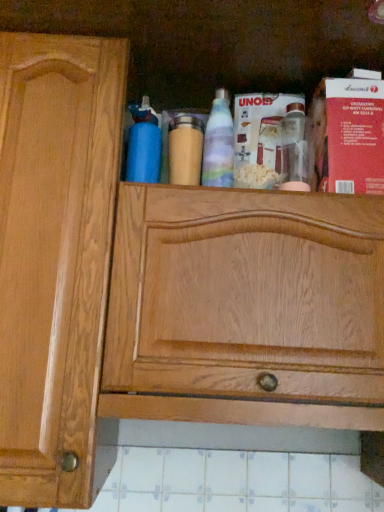
Image resolution: width=384 pixels, height=512 pixels. I want to click on translucent plastic bottle at center, positioned as the third bottle in left-to-right order, so click(219, 144).

Identify the location of wooden bottle at center, acting as the second bottle starting from the right. Image resolution: width=384 pixels, height=512 pixels. (185, 149).

Does point (223, 172) come behind point (180, 156)?

No, it is in front of (180, 156).

Can you confirm if translucent plastic bottle at center, positioned as the third bottle in left-to-right order, is positioned to the left of wooden bottle at center, which ranks as the second bottle in left-to-right order?

No, translucent plastic bottle at center, positioned as the third bottle in left-to-right order, is not to the left of wooden bottle at center, which ranks as the second bottle in left-to-right order.

Which object is more forward, translucent plastic bottle at center, the first bottle viewed from the right, or wooden bottle at center, acting as the second bottle starting from the right?

translucent plastic bottle at center, the first bottle viewed from the right, is in front.

How different are the orientations of translucent plastic bottle at center, positioned as the third bottle in left-to-right order, and wooden bottle at center, acting as the second bottle starting from the right, in degrees?

There is a 8.01e-05-degree angle between the facing directions of translucent plastic bottle at center, positioned as the third bottle in left-to-right order, and wooden bottle at center, acting as the second bottle starting from the right.

Is blue matte bottle at upper center, the third bottle viewed from the right, thinner than wooden bottle at center, acting as the second bottle starting from the right?

In fact, blue matte bottle at upper center, the third bottle viewed from the right, might be wider than wooden bottle at center, acting as the second bottle starting from the right.

From a real-world perspective, is blue matte bottle at upper center, the 1th bottle in the left-to-right sequence, located higher than wooden bottle at center, which ranks as the second bottle in left-to-right order?

Correct, in the physical world, blue matte bottle at upper center, the 1th bottle in the left-to-right sequence, is higher than wooden bottle at center, which ranks as the second bottle in left-to-right order.

Based on the photo, which object is more forward, blue matte bottle at upper center, the third bottle viewed from the right, or wooden bottle at center, acting as the second bottle starting from the right?

Positioned in front is blue matte bottle at upper center, the third bottle viewed from the right.

Consider the image. Considering the relative positions of blue matte bottle at upper center, the third bottle viewed from the right, and wooden bottle at center, which ranks as the second bottle in left-to-right order, in the image provided, is blue matte bottle at upper center, the third bottle viewed from the right, to the right of wooden bottle at center, which ranks as the second bottle in left-to-right order, from the viewer's perspective?

No.

From a real-world perspective, is wooden bottle at center, acting as the second bottle starting from the right, over blue matte bottle at upper center, the third bottle viewed from the right?

No, from a real-world perspective, wooden bottle at center, acting as the second bottle starting from the right, is not above blue matte bottle at upper center, the third bottle viewed from the right.

Are wooden bottle at center, which ranks as the second bottle in left-to-right order, and blue matte bottle at upper center, the 1th bottle in the left-to-right sequence, far apart?

That's not correct — wooden bottle at center, which ranks as the second bottle in left-to-right order, is a little close to blue matte bottle at upper center, the 1th bottle in the left-to-right sequence.

Where is `bottle that is the 1st one when counting upward from the wooden bottle at center, acting as the second bottle starting from the right (from the image's perspective)`? The height and width of the screenshot is (512, 384). bottle that is the 1st one when counting upward from the wooden bottle at center, acting as the second bottle starting from the right (from the image's perspective) is located at coordinates (143, 144).

Between wooden bottle at center, acting as the second bottle starting from the right, and blue matte bottle at upper center, the third bottle viewed from the right, which one has less height?

wooden bottle at center, acting as the second bottle starting from the right, is shorter.

Based on the photo, considering the relative sizes of blue matte bottle at upper center, the 1th bottle in the left-to-right sequence, and translucent plastic bottle at center, positioned as the third bottle in left-to-right order, in the image provided, is blue matte bottle at upper center, the 1th bottle in the left-to-right sequence, wider than translucent plastic bottle at center, positioned as the third bottle in left-to-right order,?

Yes, blue matte bottle at upper center, the 1th bottle in the left-to-right sequence, is wider than translucent plastic bottle at center, positioned as the third bottle in left-to-right order.

Is blue matte bottle at upper center, the third bottle viewed from the right, taller than translucent plastic bottle at center, the first bottle viewed from the right?

No, blue matte bottle at upper center, the third bottle viewed from the right, is not taller than translucent plastic bottle at center, the first bottle viewed from the right.

From a real-world perspective, between blue matte bottle at upper center, the third bottle viewed from the right, and translucent plastic bottle at center, positioned as the third bottle in left-to-right order, who is vertically lower?

From a 3D spatial view, blue matte bottle at upper center, the third bottle viewed from the right, is below.

How many degrees apart are the facing directions of wooden bottle at center, acting as the second bottle starting from the right, and translucent plastic bottle at center, positioned as the third bottle in left-to-right order?

The facing directions of wooden bottle at center, acting as the second bottle starting from the right, and translucent plastic bottle at center, positioned as the third bottle in left-to-right order, are 8.01e-05 degrees apart.

From the picture: Considering the positions of objects wooden bottle at center, acting as the second bottle starting from the right, and translucent plastic bottle at center, the first bottle viewed from the right, in the image provided, who is behind, wooden bottle at center, acting as the second bottle starting from the right, or translucent plastic bottle at center, the first bottle viewed from the right,?

wooden bottle at center, acting as the second bottle starting from the right, is further from the camera.

Can you confirm if wooden bottle at center, acting as the second bottle starting from the right, is bigger than translucent plastic bottle at center, positioned as the third bottle in left-to-right order?

Incorrect, wooden bottle at center, acting as the second bottle starting from the right, is not larger than translucent plastic bottle at center, positioned as the third bottle in left-to-right order.

From a real-world perspective, between wooden bottle at center, which ranks as the second bottle in left-to-right order, and translucent plastic bottle at center, the first bottle viewed from the right, who is vertically higher?

translucent plastic bottle at center, the first bottle viewed from the right, from a real-world perspective.

How far apart are translucent plastic bottle at center, the first bottle viewed from the right, and blue matte bottle at upper center, the third bottle viewed from the right?

translucent plastic bottle at center, the first bottle viewed from the right, is 5.26 inches away from blue matte bottle at upper center, the third bottle viewed from the right.

Looking at this image, looking at the image, does translucent plastic bottle at center, positioned as the third bottle in left-to-right order, seem bigger or smaller compared to blue matte bottle at upper center, the third bottle viewed from the right?

Considering their sizes, translucent plastic bottle at center, positioned as the third bottle in left-to-right order, takes up less space than blue matte bottle at upper center, the third bottle viewed from the right.

Where is `bottle located in front of the translucent plastic bottle at center, the first bottle viewed from the right`? Image resolution: width=384 pixels, height=512 pixels. bottle located in front of the translucent plastic bottle at center, the first bottle viewed from the right is located at coordinates (143, 144).

Between translucent plastic bottle at center, the first bottle viewed from the right, and blue matte bottle at upper center, the third bottle viewed from the right, which one is positioned in front?

Positioned in front is blue matte bottle at upper center, the third bottle viewed from the right.

Locate an element on the screen. This screenshot has width=384, height=512. bottle that is the 2nd one above the wooden bottle at center, acting as the second bottle starting from the right (from a real-world perspective) is located at coordinates (219, 144).

Which bottle is the 2nd one when counting from the back of the blue matte bottle at upper center, the 1th bottle in the left-to-right sequence? Please provide its 2D coordinates.

[(185, 149)]

Looking at the image, which one is located further to translucent plastic bottle at center, the first bottle viewed from the right, wooden bottle at center, acting as the second bottle starting from the right, or blue matte bottle at upper center, the 1th bottle in the left-to-right sequence?

Among the two, blue matte bottle at upper center, the 1th bottle in the left-to-right sequence, is located further to translucent plastic bottle at center, the first bottle viewed from the right.

Considering their positions, is wooden bottle at center, acting as the second bottle starting from the right, positioned further to blue matte bottle at upper center, the third bottle viewed from the right, than translucent plastic bottle at center, the first bottle viewed from the right?

translucent plastic bottle at center, the first bottle viewed from the right, lies further to blue matte bottle at upper center, the third bottle viewed from the right, than the other object.

Which object lies further to the anchor point wooden bottle at center, which ranks as the second bottle in left-to-right order, blue matte bottle at upper center, the third bottle viewed from the right, or translucent plastic bottle at center, positioned as the third bottle in left-to-right order?

blue matte bottle at upper center, the third bottle viewed from the right, lies further to wooden bottle at center, which ranks as the second bottle in left-to-right order, than the other object.

In the scene shown: Which object lies nearer to the anchor point translucent plastic bottle at center, the first bottle viewed from the right, blue matte bottle at upper center, the 1th bottle in the left-to-right sequence, or wooden bottle at center, which ranks as the second bottle in left-to-right order?

wooden bottle at center, which ranks as the second bottle in left-to-right order, is closer to translucent plastic bottle at center, the first bottle viewed from the right.

Looking at the image, which one is located further to blue matte bottle at upper center, the 1th bottle in the left-to-right sequence, translucent plastic bottle at center, positioned as the third bottle in left-to-right order, or wooden bottle at center, acting as the second bottle starting from the right?

Among the two, translucent plastic bottle at center, positioned as the third bottle in left-to-right order, is located further to blue matte bottle at upper center, the 1th bottle in the left-to-right sequence.

Based on their spatial positions, is translucent plastic bottle at center, the first bottle viewed from the right, or blue matte bottle at upper center, the third bottle viewed from the right, further from wooden bottle at center, which ranks as the second bottle in left-to-right order?

blue matte bottle at upper center, the third bottle viewed from the right, lies further to wooden bottle at center, which ranks as the second bottle in left-to-right order, than the other object.

The height and width of the screenshot is (512, 384). I want to click on bottle located between blue matte bottle at upper center, the third bottle viewed from the right, and translucent plastic bottle at center, the first bottle viewed from the right, in the left-right direction, so click(185, 149).